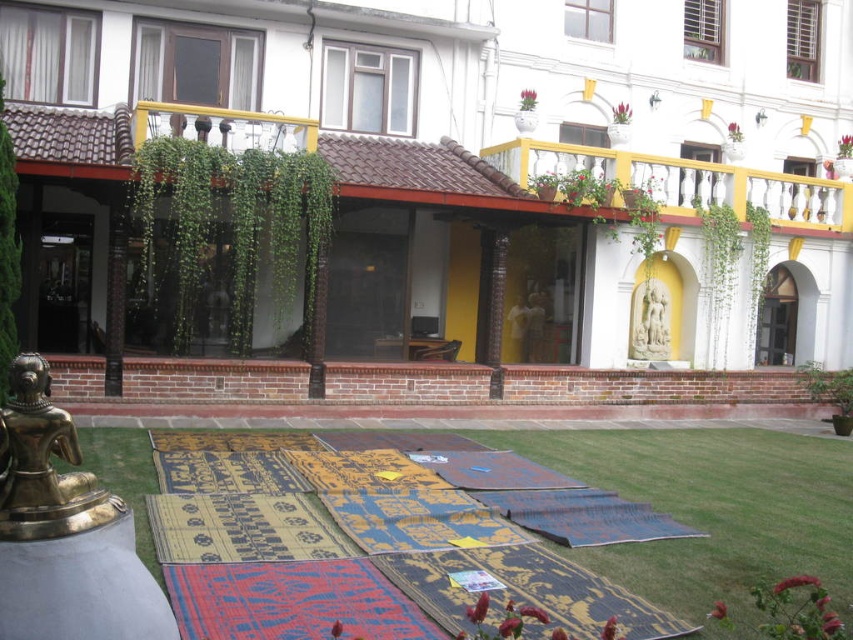
Question: Is textured woolen mat at lower center below white stone statue at center?

Choices:
 (A) yes
 (B) no

Answer: (A)

Question: Estimate the real-world distances between objects in this image. Which object is farther from the textured woolen mat at lower center?

Choices:
 (A) white stone statue at center
 (B) brass statue at lower left

Answer: (A)

Question: Does textured woolen mat at lower center appear on the left side of white stone statue at center?

Choices:
 (A) no
 (B) yes

Answer: (B)

Question: Which point is farther to the camera?

Choices:
 (A) (x=70, y=448)
 (B) (x=662, y=321)

Answer: (B)

Question: Which object is farther from the camera taking this photo?

Choices:
 (A) textured woolen mat at lower center
 (B) brass statue at lower left

Answer: (A)

Question: Can you confirm if textured woolen mat at lower center is positioned to the left of white stone statue at center?

Choices:
 (A) yes
 (B) no

Answer: (A)